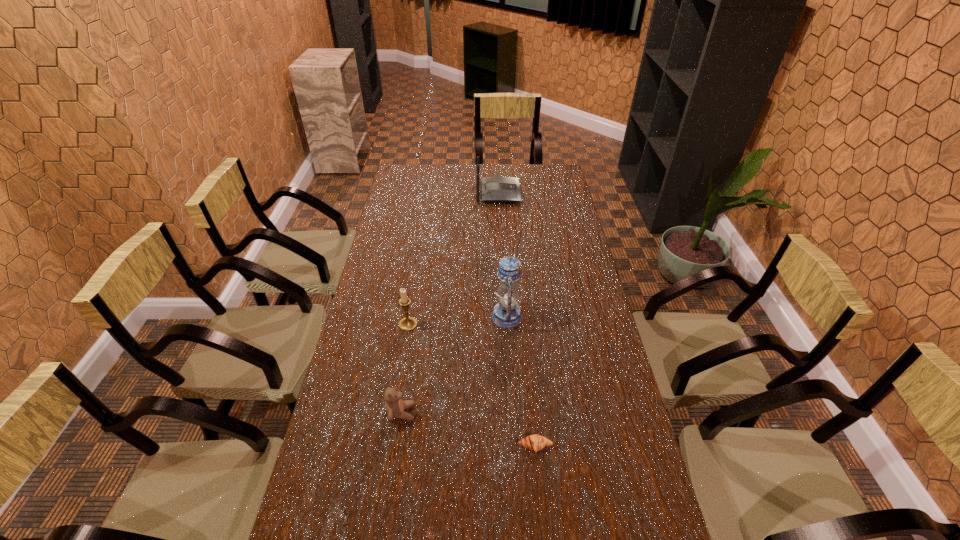
The width and height of the screenshot is (960, 540). Find the location of `lantern`. lantern is located at coordinates coord(506,314).

Identify the location of candle holder. (408, 323).

The width and height of the screenshot is (960, 540). I want to click on the farthest object, so click(494, 189).

Locate an element on the screen. the second nearest object is located at coordinates (395, 406).

Find the location of a particular element. the second shortest object is located at coordinates (395, 406).

Where is `pastry`? pastry is located at coordinates (535, 442).

Find the location of a particular element. Image resolution: width=960 pixels, height=540 pixels. the nearest object is located at coordinates (535, 442).

Identify the location of vacant space located on the front-facing side of the tallest object. The width and height of the screenshot is (960, 540). (447, 316).

You are a GUI agent. You are given a task and a screenshot of the screen. Output one action in this format:
    pyautogui.click(x=<x>, y=<y>)
    Task: Click on the free spot located on the front-facing side of the tallest object
    The image size is (960, 540).
    Given the screenshot: What is the action you would take?
    pyautogui.click(x=432, y=316)

At what (x,y) coordinates should I click in order to perform the action: click on vacant area situated on the front-facing side of the tallest object. Please return your answer as a coordinate pair (x, y). This screenshot has height=540, width=960. Looking at the image, I should click on (373, 316).